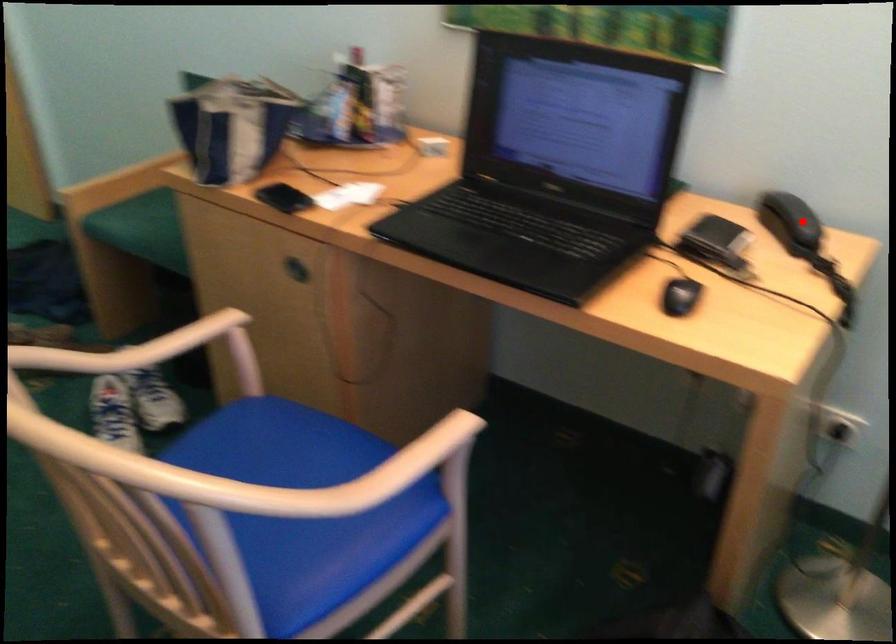
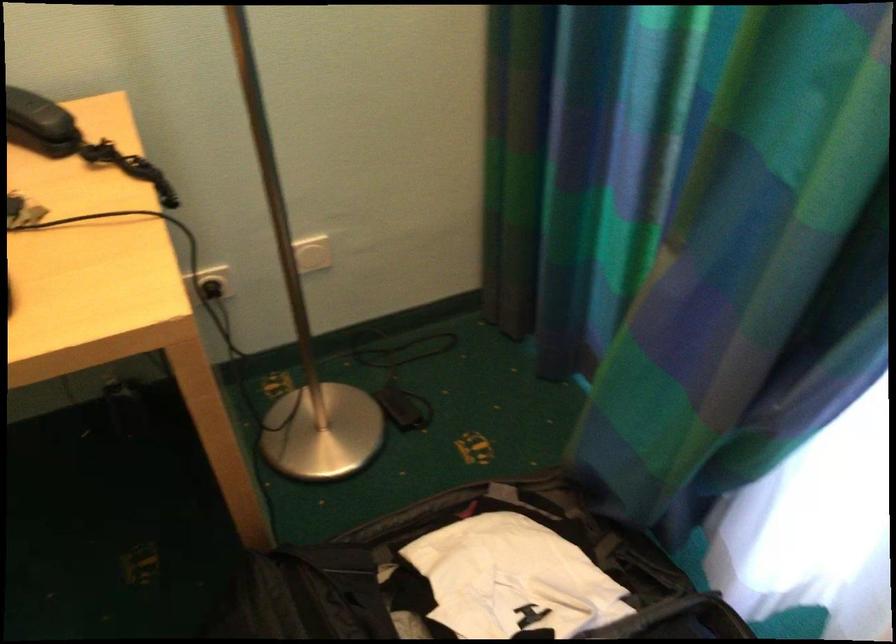
The point at the highlighted location is marked in the first image. Where is the corresponding point in the second image?

(40, 122)